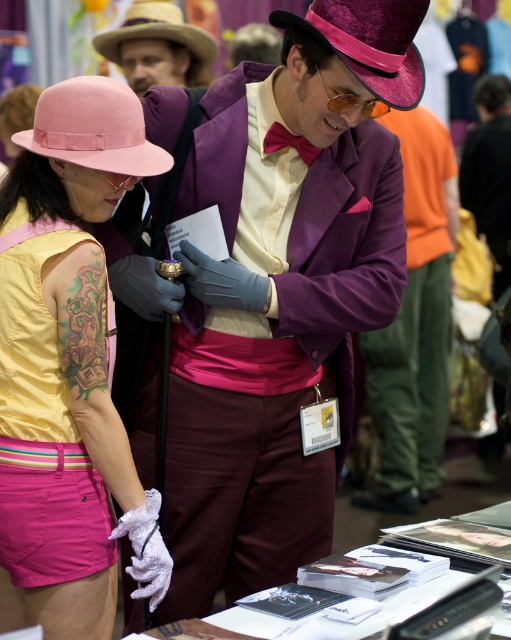
Does straw cowboy hat at upper left have a larger size compared to maroon satin bow tie at center?

Yes, straw cowboy hat at upper left is bigger than maroon satin bow tie at center.

Is straw cowboy hat at upper left positioned in front of maroon satin bow tie at center?

No.

Which is in front, point (146, 24) or point (307, 163)?

Point (307, 163) is more forward.

At what (x,y) coordinates should I click in order to perform the action: click on straw cowboy hat at upper left. Please return your answer as a coordinate pair (x, y). Looking at the image, I should click on (155, 29).

Who is more distant from viewer, [12,166] or [34,124]?

Point [34,124]

Which is in front, point (102, 595) or point (33, 141)?

Point (33, 141)

The image size is (511, 640). Find the location of `matte pink hat at upper left`. matte pink hat at upper left is located at coordinates (71, 273).

Is pink fabric dress at lower left to the right of maroon satin bow tie at center from the viewer's perspective?

Incorrect, pink fabric dress at lower left is not on the right side of maroon satin bow tie at center.

Does pink fabric dress at lower left have a greater width compared to maroon satin bow tie at center?

Correct, the width of pink fabric dress at lower left exceeds that of maroon satin bow tie at center.

Which is in front, point (38, 305) or point (295, 147)?

Point (38, 305)

The height and width of the screenshot is (640, 511). Identify the location of pink fabric dress at lower left. (42, 438).